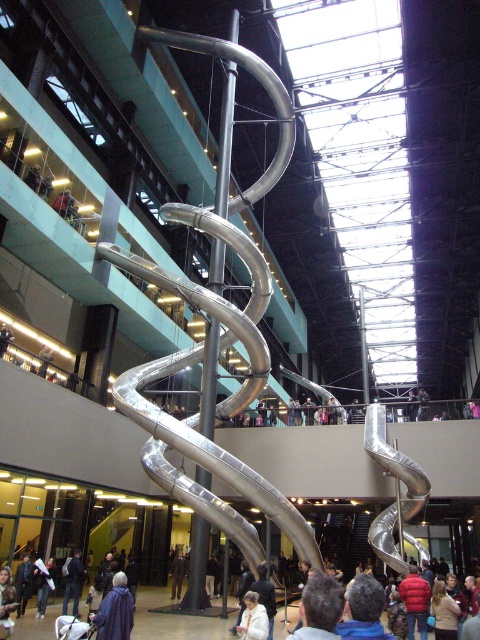
Question: Does white matte jacket at lower center appear on the right side of dark blue jacket at lower left?

Choices:
 (A) no
 (B) yes

Answer: (B)

Question: Observing the image, what is the correct spatial positioning of purple fabric coat at lower center in reference to dark blue jacket at lower left?

Choices:
 (A) below
 (B) above

Answer: (B)

Question: Which object is farther from the camera taking this photo?

Choices:
 (A) silver/metallic pole at center
 (B) purple fabric coat at lower center
 (C) white matte jacket at lower center

Answer: (A)

Question: Does silver/metallic pole at center have a greater width compared to purple fabric coat at lower center?

Choices:
 (A) no
 (B) yes

Answer: (B)

Question: Among these points, which one is farthest from the camera?

Choices:
 (A) (229, 129)
 (B) (243, 634)

Answer: (A)

Question: Considering the real-world distances, which object is closest to the white matte jacket at lower center?

Choices:
 (A) silver/metallic pole at center
 (B) dark blue jacket at lower left

Answer: (B)